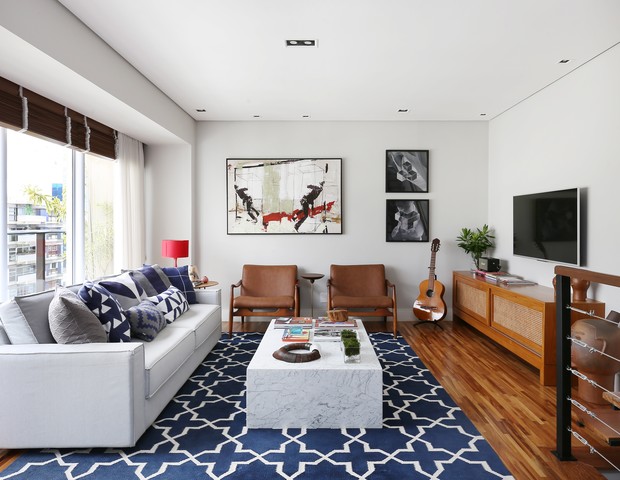
What are the coordinates of `chairs` in the screenshot? It's located at (273, 290).